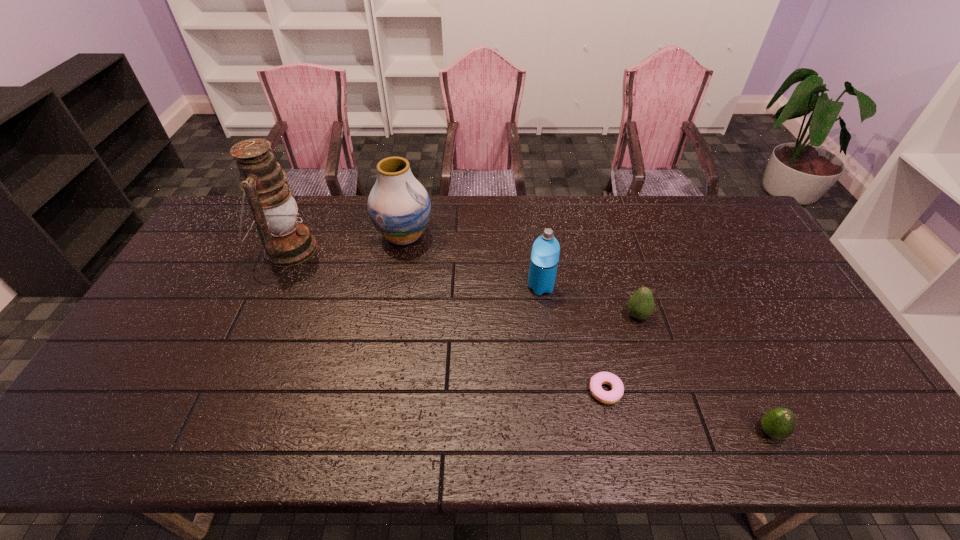
Locate an element on the screen. The width and height of the screenshot is (960, 540). the tallest object is located at coordinates (286, 243).

This screenshot has height=540, width=960. In order to click on the leftmost object in this screenshot , I will do `click(286, 243)`.

I want to click on the fifth shortest object, so click(x=399, y=207).

I want to click on vase, so click(x=399, y=207).

The height and width of the screenshot is (540, 960). Find the location of `thermos bottle`. thermos bottle is located at coordinates [545, 252].

Locate an element on the screen. This screenshot has width=960, height=540. the third object from left to right is located at coordinates (545, 252).

You are a GUI agent. You are given a task and a screenshot of the screen. Output one action in this format:
    pyautogui.click(x=<x>, y=<y>)
    Task: Click on the farther avocado
    
    Given the screenshot: What is the action you would take?
    pyautogui.click(x=641, y=304)

Find the location of `the second object from right to left`. the second object from right to left is located at coordinates (641, 304).

Locate an element on the screen. the fifth tallest object is located at coordinates (779, 423).

This screenshot has width=960, height=540. Identify the location of the nearer avocado. (779, 423).